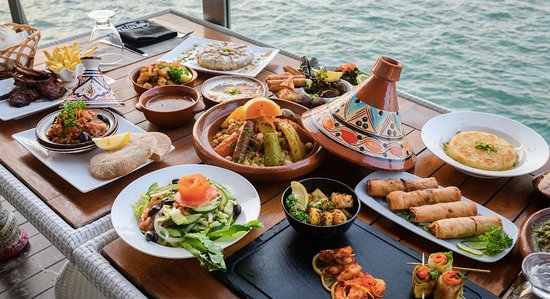
The image size is (550, 299). I want to click on bowl, so click(330, 184), click(244, 194), click(449, 121), click(205, 83), click(168, 90), click(132, 75), click(108, 120), click(531, 220), click(537, 183), click(536, 264).